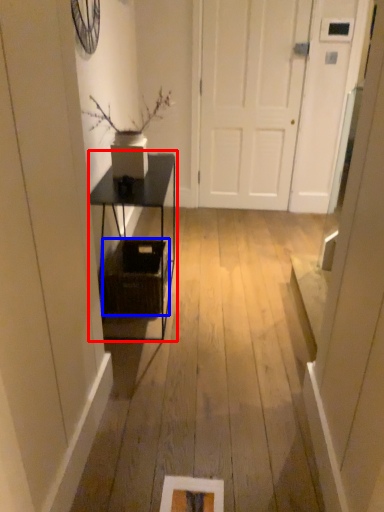
Question: Which of the following is the closest to the observer, table (highlighted by a red box) or basket (highlighted by a blue box)?

Choices:
 (A) table
 (B) basket

Answer: (A)